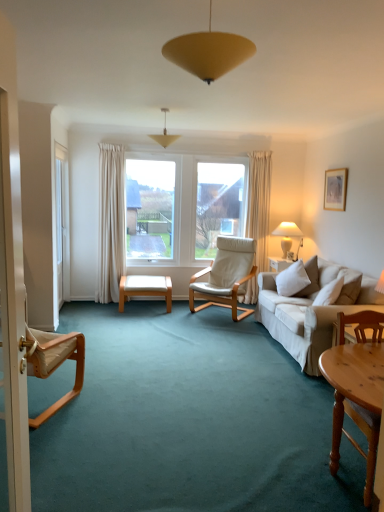
Question: From a real-world perspective, is light wood bench at center above or below white leather chair at center, the second chair positioned from the left?

Choices:
 (A) below
 (B) above

Answer: (A)

Question: Is light wood bench at center inside or outside of white leather chair at center, the second chair positioned from the left?

Choices:
 (A) outside
 (B) inside

Answer: (A)

Question: Which is farther from the matte white picture frame at upper right?

Choices:
 (A) light wood bench at center
 (B) matte yellow cone at upper center, which is counted as the 2th lamp, starting from the right
 (C) white leather chair at center, which is the 2th chair from right to left
 (D) white plastic screen door at left
 (E) white ceramic lamp at right, which ranks as the first lamp in back-to-front order

Answer: (D)

Question: Which of these objects is positioned farthest from the matte yellow cone at center, marked as the 2th lamp in a front-to-back arrangement?

Choices:
 (A) white plastic screen door at left
 (B) wooden chair at lower right, which is counted as the 1th chair, starting from the front
 (C) matte yellow cone at upper center, arranged as the 1th lamp when viewed from the front
 (D) matte white picture frame at upper right
 (E) light wood bench at center

Answer: (C)